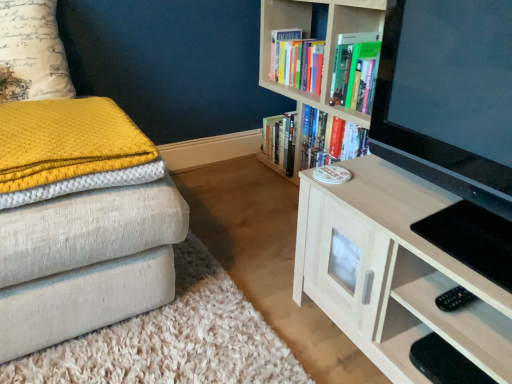
Measure the distance between point (453, 320) and camera.

Point (453, 320) is 37.05 inches away from camera.

What do you see at coordinates (70, 149) in the screenshot?
I see `yellow textured blanket at left` at bounding box center [70, 149].

In order to click on yellow textured pillow at upper left in this screenshot , I will do `click(32, 52)`.

Where is `light wood cabinet at center, which appears as the second bookcase when viewed from the back`? The width and height of the screenshot is (512, 384). light wood cabinet at center, which appears as the second bookcase when viewed from the back is located at coordinates (419, 193).

Is yellow textured blanket at left taller or shorter than black plastic remote control at lower right?

yellow textured blanket at left is shorter than black plastic remote control at lower right.

Would you say yellow textured blanket at left contains black plastic remote control at lower right?

No.

Is yellow textured blanket at left oriented towards black plastic remote control at lower right?

No, yellow textured blanket at left does not turn towards black plastic remote control at lower right.

Considering the positions of objects yellow textured blanket at left and black plastic remote control at lower right in the image provided, who is more to the left, yellow textured blanket at left or black plastic remote control at lower right?

Positioned to the left is yellow textured blanket at left.

Consider the image. From the image's perspective, between black plastic remote control at lower right and light wood cabinet at center, which appears as the second bookcase when viewed from the back, who is located below?

black plastic remote control at lower right is shown below in the image.

Is black plastic remote control at lower right oriented towards light wood cabinet at center, which appears as the second bookcase when viewed from the back?

Yes.

Where is `bookcase that is in front of the black plastic remote control at lower right`? This screenshot has width=512, height=384. bookcase that is in front of the black plastic remote control at lower right is located at coordinates (419, 193).

From a real-world perspective, which object stands above the other?

light wood cabinet at center, marked as the 1th bookcase in a front-to-back arrangement, is physically above.

How far apart are black plastic remote control at lower right and yellow textured blanket at left?

black plastic remote control at lower right is 33.81 inches from yellow textured blanket at left.

Can you confirm if black plastic remote control at lower right is bigger than yellow textured blanket at left?

Incorrect, black plastic remote control at lower right is not larger than yellow textured blanket at left.

Locate an element on the screen. The width and height of the screenshot is (512, 384). drawer in front of the yellow textured blanket at left is located at coordinates (441, 318).

Between black plastic remote control at lower right and yellow textured blanket at left, which one is positioned behind?

yellow textured blanket at left is further from the camera.

Does wooden bookcase at upper right, placed as the 2th bookcase when sorted from front to back, touch yellow textured blanket at left?

No, wooden bookcase at upper right, placed as the 2th bookcase when sorted from front to back, is not in contact with yellow textured blanket at left.

Looking at this image, from a real-world perspective, is wooden bookcase at upper right, the 1th bookcase positioned from the back, located higher than yellow textured blanket at left?

No, from a real-world perspective, wooden bookcase at upper right, the 1th bookcase positioned from the back, is not over yellow textured blanket at left

Which object is positioned more to the right, wooden bookcase at upper right, placed as the 2th bookcase when sorted from front to back, or yellow textured blanket at left?

wooden bookcase at upper right, placed as the 2th bookcase when sorted from front to back.

Is wooden bookcase at upper right, placed as the 2th bookcase when sorted from front to back, bigger than yellow textured blanket at left?

Correct, wooden bookcase at upper right, placed as the 2th bookcase when sorted from front to back, is larger in size than yellow textured blanket at left.

From the picture: How far apart are black plastic remote control at lower right and wooden bookcase at upper right, the 1th bookcase positioned from the back?

black plastic remote control at lower right and wooden bookcase at upper right, the 1th bookcase positioned from the back, are 1.00 meters apart from each other.

Is black plastic remote control at lower right bigger than wooden bookcase at upper right, placed as the 2th bookcase when sorted from front to back?

Incorrect, black plastic remote control at lower right is not larger than wooden bookcase at upper right, placed as the 2th bookcase when sorted from front to back.

Can you confirm if black plastic remote control at lower right is thinner than wooden bookcase at upper right, placed as the 2th bookcase when sorted from front to back?

Correct, the width of black plastic remote control at lower right is less than that of wooden bookcase at upper right, placed as the 2th bookcase when sorted from front to back.

Find the location of a particular element. The image size is (512, 384). the 2nd bookcase to the left when counting from the black plastic remote control at lower right is located at coordinates (324, 52).

Could you tell me if yellow textured blanket at left is turned towards light wood cabinet at center, which appears as the second bookcase when viewed from the back?

No.

Between yellow textured blanket at left and light wood cabinet at center, marked as the 1th bookcase in a front-to-back arrangement, which one has smaller size?

With smaller size is yellow textured blanket at left.

From a real-world perspective, is yellow textured blanket at left under light wood cabinet at center, marked as the 1th bookcase in a front-to-back arrangement?

Incorrect, from a real-world perspective, yellow textured blanket at left is higher than light wood cabinet at center, marked as the 1th bookcase in a front-to-back arrangement.

Is light wood cabinet at center, marked as the 1th bookcase in a front-to-back arrangement, oriented away from yellow textured pillow at upper left?

No, yellow textured pillow at upper left is not at the back of light wood cabinet at center, marked as the 1th bookcase in a front-to-back arrangement.

Is light wood cabinet at center, which appears as the second bookcase when viewed from the back, positioned behind yellow textured pillow at upper left?

That is False.

Is light wood cabinet at center, which appears as the second bookcase when viewed from the back, wider than yellow textured pillow at upper left?

Yes, light wood cabinet at center, which appears as the second bookcase when viewed from the back, is wider than yellow textured pillow at upper left.

Does light wood cabinet at center, which appears as the second bookcase when viewed from the back, have a lesser height compared to yellow textured pillow at upper left?

In fact, light wood cabinet at center, which appears as the second bookcase when viewed from the back, may be taller than yellow textured pillow at upper left.

Where is `drawer that appears below the yellow textured blanket at left (from the image's perspective)`? drawer that appears below the yellow textured blanket at left (from the image's perspective) is located at coordinates (441, 318).

Locate an element on the screen. The width and height of the screenshot is (512, 384). drawer on the right of light wood cabinet at center, which appears as the second bookcase when viewed from the back is located at coordinates (441, 318).

From the image, which object appears to be farther from yellow textured pillow at upper left, black plastic remote control at lower right or hardcover books at center, the 2th book viewed from the top?

Among the two, black plastic remote control at lower right is located further to yellow textured pillow at upper left.

Based on their spatial positions, is yellow textured pillow at upper left or yellow textured blanket at left further from hardcover books at center, the 2th book viewed from the top?

yellow textured pillow at upper left.

Which object lies nearer to the anchor point light wood cabinet at center, marked as the 1th bookcase in a front-to-back arrangement, yellow textured blanket at left or hardcover books at center, the 2th book viewed from the top?

The object closer to light wood cabinet at center, marked as the 1th bookcase in a front-to-back arrangement, is yellow textured blanket at left.

Which object lies further to the anchor point black plastic remote control at lower right, hardcover books at upper center, acting as the 2th book starting from the bottom, or wooden bookcase at upper right, the 1th bookcase positioned from the back?

The object further to black plastic remote control at lower right is hardcover books at upper center, acting as the 2th book starting from the bottom.

From the image, which object appears to be nearer to wooden bookcase at upper right, the 1th bookcase positioned from the back, hardcover books at upper center, acting as the 2th book starting from the bottom, or light wood cabinet at center, marked as the 1th bookcase in a front-to-back arrangement?

Among the two, hardcover books at upper center, acting as the 2th book starting from the bottom, is located nearer to wooden bookcase at upper right, the 1th bookcase positioned from the back.

Considering their positions, is wooden bookcase at upper right, placed as the 2th bookcase when sorted from front to back, positioned closer to hardcover books at center, the 2th book viewed from the top, than yellow textured blanket at left?

wooden bookcase at upper right, placed as the 2th bookcase when sorted from front to back, lies closer to hardcover books at center, the 2th book viewed from the top, than the other object.

Which object lies further to the anchor point hardcover books at center, the first book when ordered from bottom to top, yellow textured blanket at left or yellow textured pillow at upper left?

yellow textured pillow at upper left lies further to hardcover books at center, the first book when ordered from bottom to top, than the other object.

Looking at this image, when comparing their distances from wooden bookcase at upper right, the 1th bookcase positioned from the back, does light wood cabinet at center, marked as the 1th bookcase in a front-to-back arrangement, or hardcover books at upper center, acting as the 2th book starting from the bottom, seem further?

Based on the image, light wood cabinet at center, marked as the 1th bookcase in a front-to-back arrangement, appears to be further to wooden bookcase at upper right, the 1th bookcase positioned from the back.

You are a GUI agent. You are given a task and a screenshot of the screen. Output one action in this format:
    pyautogui.click(x=<x>, y=<y>)
    Task: Click on the bookcase positioned between yellow textured blanket at left and hardcover books at center, the first book when ordered from bottom to top, from near to far
    This screenshot has width=512, height=384.
    Given the screenshot: What is the action you would take?
    pyautogui.click(x=324, y=52)

You are a GUI agent. You are given a task and a screenshot of the screen. Output one action in this format:
    pyautogui.click(x=<x>, y=<y>)
    Task: Click on the blanket located between light wood cabinet at center, marked as the 1th bookcase in a front-to-back arrangement, and hardcover books at upper center, the 1th book positioned from the top, in the depth direction
    
    Given the screenshot: What is the action you would take?
    pyautogui.click(x=70, y=149)

Where is `bookcase between black plastic remote control at lower right and hardcover books at center, the 2th book viewed from the top, from front to back`? bookcase between black plastic remote control at lower right and hardcover books at center, the 2th book viewed from the top, from front to back is located at coordinates (324, 52).

Identify the location of book situated between yellow textured pillow at upper left and hardcover books at upper center, the 1th book positioned from the top, from left to right. (310, 141).